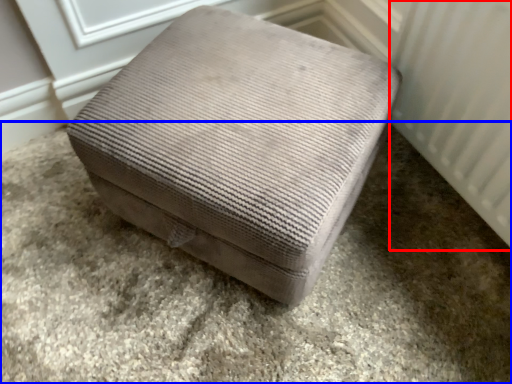
Question: Which object is further to the camera taking this photo, radiator (highlighted by a red box) or concrete (highlighted by a blue box)?

Choices:
 (A) radiator
 (B) concrete

Answer: (B)